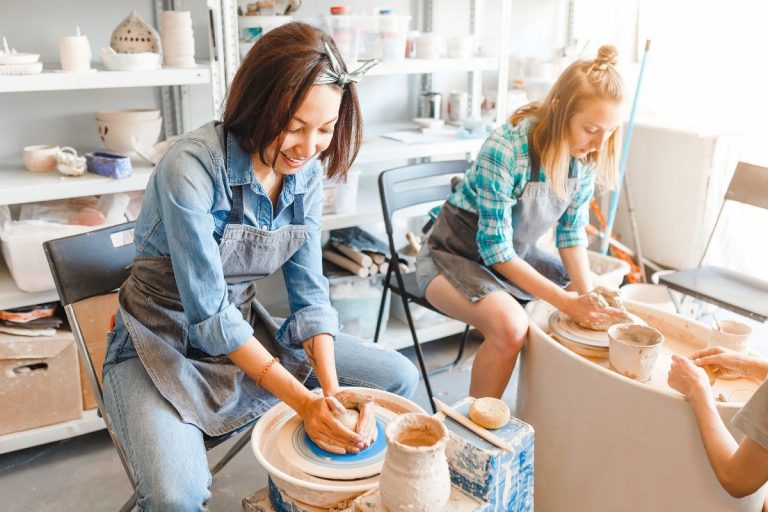
Identify the location of candle. (77, 48).